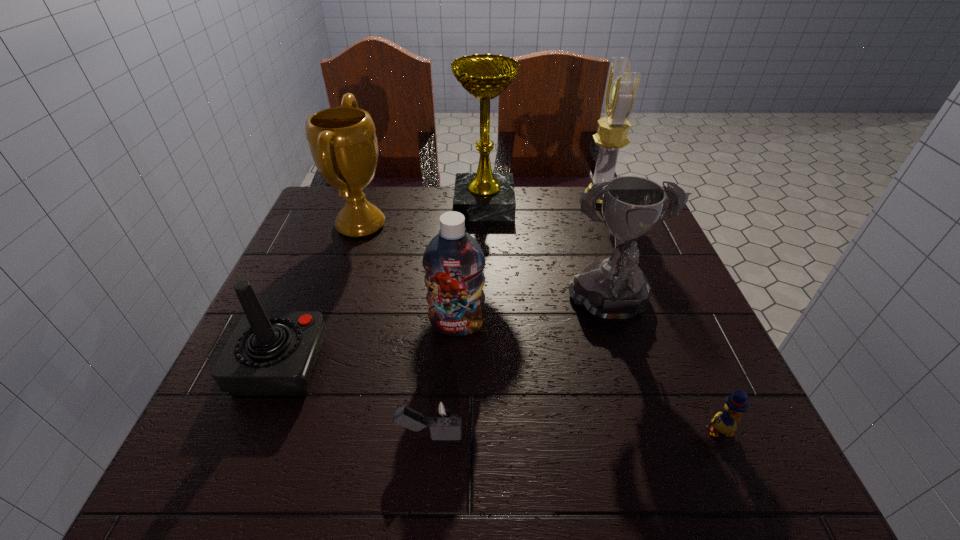
Identify the location of vacant region between the igniter and the leftmost award. (396, 330).

Identify which object is the third closest to the duckling. Please provide its 2D coordinates. Your answer should be formatted as a tuple, i.e. [(x, y)], where the tuple contains the x and y coordinates of a point satisfying the conditions above.

[(453, 260)]

Locate which object is the fourth closest to the duckling. Please provide its 2D coordinates. Your answer should be formatted as a tuple, i.e. [(x, y)], where the tuple contains the x and y coordinates of a point satisfying the conditions above.

[(622, 86)]

This screenshot has width=960, height=540. I want to click on award that can be found as the closest to the duckling, so click(x=614, y=289).

The width and height of the screenshot is (960, 540). Identify the location of the second closest award to the shampoo. (342, 140).

This screenshot has height=540, width=960. Identify the location of free space that satisfies the following two spatial constraints: 1. on the front-facing side of the igniter; 2. on the left side of the sixth tallest object. (252, 436).

The image size is (960, 540). In order to click on free location that satisfies the following two spatial constraints: 1. on the back side of the igniter; 2. on the front-facing side of the joystick in this screenshot , I will do `click(437, 364)`.

At what (x,y) coordinates should I click in order to perform the action: click on vacant region that satisfies the following two spatial constraints: 1. on the front of the leftmost award with the decoration; 2. on the back side of the igniter. Please return your answer as a coordinate pair (x, y). Looking at the image, I should click on (288, 436).

This screenshot has width=960, height=540. I want to click on vacant space that satisfies the following two spatial constraints: 1. on the front-facing side of the third award from right to left; 2. on the front side of the igniter, so click(x=488, y=436).